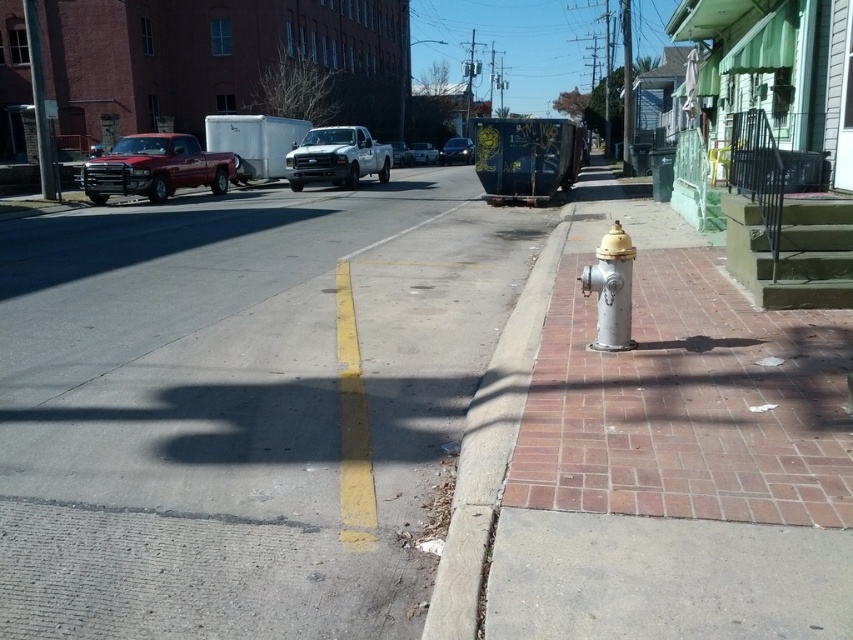
You are a pedestrian standing at point (601, 323) and want to walk to point (358, 148). Given the street layout described, will you have to cross the road to reach your destination?

Point (358, 148) is behind point (601, 323), so you can reach it without crossing the road by moving backward along the sidewalk.

You are a delivery driver who needs to park your vehicle on the sidewalk near the silver metallic fire hydrant at right. According to local regulations, parking within 5 meters of a fire hydrant is prohibited. If the distance from your current position to the fire hydrant is 4.8 meters, can you legally park here?

The distance from your current position to the silver metallic fire hydrant at right is 4.8 meters, which is less than the 5 meters required by local regulations. Therefore, you cannot legally park here.

You are standing on the sidewalk next to the silver fire hydrant with a yellow top. You want to cross the road to reach the white matte truck at center. Is the distance between you and the truck sufficient to safely cross the road before any oncoming traffic arrives?

The distance between you and the white matte truck at center is 58.04 feet. This distance is sufficient to safely cross the road before any oncoming traffic arrives, assuming typical walking speed and traffic conditions.